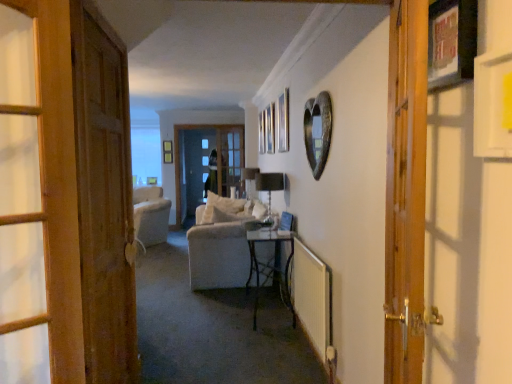
Question: Choose the correct answer: Is wooden door at right, positioned as the 1th door in right-to-left order, inside wooden picture frame at upper right, which appears as the first picture frame when viewed from the right, or outside it?

Choices:
 (A) inside
 (B) outside

Answer: (B)

Question: In the image, is wooden door at right, acting as the 2th door starting from the left, on the left side or the right side of wooden picture frame at upper right, which is counted as the first picture frame, starting from the front?

Choices:
 (A) left
 (B) right

Answer: (A)

Question: Estimate the real-world distances between objects in this image. Which object is farther from the metallic heart at upper right, arranged as the first picture frame when viewed from the back?

Choices:
 (A) wooden door at left, marked as the 1th door in a back-to-front arrangement
 (B) wooden picture frame at upper right, which appears as the first picture frame when viewed from the right
 (C) wooden door at right, the 2th door viewed from the back

Answer: (B)

Question: Estimate the real-world distances between objects in this image. Which object is farther from the metallic heart at upper right, arranged as the first picture frame when viewed from the back?

Choices:
 (A) wooden door at right, positioned as the 1th door in right-to-left order
 (B) wooden door at left, placed as the second door when sorted from front to back
 (C) wooden picture frame at upper right, arranged as the 2th picture frame when viewed from the left

Answer: (C)